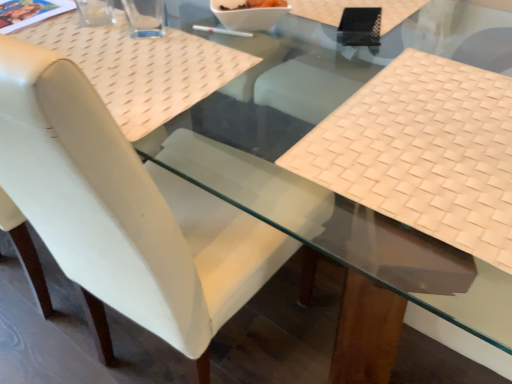
Where is `free space above beige woven mat at right (from a real-world perspective)`? The width and height of the screenshot is (512, 384). free space above beige woven mat at right (from a real-world perspective) is located at coordinates (440, 130).